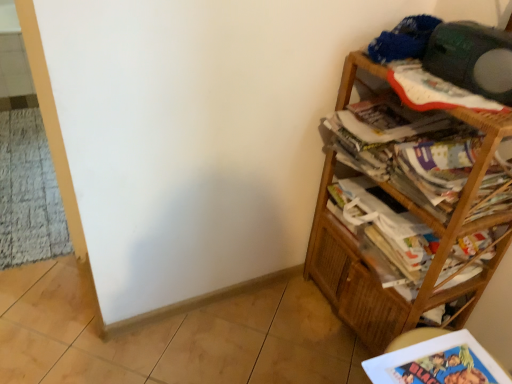
Question: Can you confirm if printed paper magazine at right, the first magazine when ordered from top to bottom, is taller than wooden bookcase at right?

Choices:
 (A) no
 (B) yes

Answer: (A)

Question: From a real-world perspective, is printed paper magazine at right, the first magazine when ordered from top to bottom, on top of wooden bookcase at right?

Choices:
 (A) no
 (B) yes

Answer: (B)

Question: Is printed paper magazine at right, positioned as the second magazine in bottom-to-top order, closer to the viewer compared to wooden bookcase at right?

Choices:
 (A) yes
 (B) no

Answer: (B)

Question: From a real-world perspective, is printed paper magazine at right, positioned as the second magazine in bottom-to-top order, below wooden bookcase at right?

Choices:
 (A) yes
 (B) no

Answer: (B)

Question: Is printed paper magazine at right, positioned as the second magazine in bottom-to-top order, in contact with wooden bookcase at right?

Choices:
 (A) yes
 (B) no

Answer: (B)

Question: In the image, is white glossy book at lower right positioned in front of or behind green matte speaker at upper right?

Choices:
 (A) front
 (B) behind

Answer: (A)

Question: Is white glossy book at lower right inside the boundaries of green matte speaker at upper right, or outside?

Choices:
 (A) inside
 (B) outside

Answer: (B)

Question: Considering the positions of white glossy book at lower right and green matte speaker at upper right in the image, is white glossy book at lower right bigger or smaller than green matte speaker at upper right?

Choices:
 (A) small
 (B) big

Answer: (A)

Question: In the image, is white glossy book at lower right on the left side or the right side of green matte speaker at upper right?

Choices:
 (A) left
 (B) right

Answer: (A)

Question: Looking at the image, does printed paper magazine at right, positioned as the second magazine in bottom-to-top order, seem bigger or smaller compared to printed paper magazine at right, the 2th magazine positioned from the top?

Choices:
 (A) small
 (B) big

Answer: (B)

Question: Would you say printed paper magazine at right, the first magazine when ordered from top to bottom, is inside or outside printed paper magazine at right, the 2th magazine positioned from the top?

Choices:
 (A) inside
 (B) outside

Answer: (B)

Question: Is printed paper magazine at right, positioned as the second magazine in bottom-to-top order, in front of or behind printed paper magazine at right, the 1th magazine when ordered from bottom to top, in the image?

Choices:
 (A) behind
 (B) front

Answer: (B)

Question: In terms of width, does printed paper magazine at right, positioned as the second magazine in bottom-to-top order, look wider or thinner when compared to printed paper magazine at right, the 1th magazine when ordered from bottom to top?

Choices:
 (A) wide
 (B) thin

Answer: (A)

Question: From their relative heights in the image, would you say wooden bookcase at right is taller or shorter than printed paper magazine at right, the 2th magazine positioned from the top?

Choices:
 (A) short
 (B) tall

Answer: (B)

Question: Based on their positions, is wooden bookcase at right located to the left or right of printed paper magazine at right, the 1th magazine when ordered from bottom to top?

Choices:
 (A) left
 (B) right

Answer: (A)